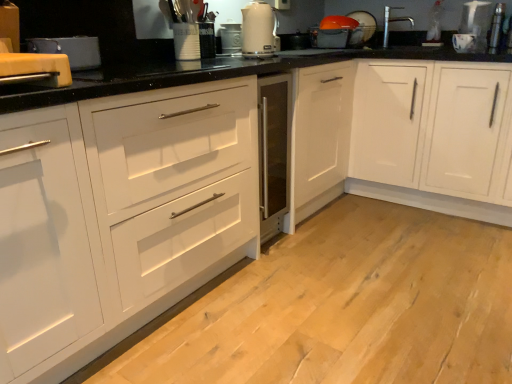
Question: Does point (247, 21) appear closer or farther from the camera than point (222, 23)?

Choices:
 (A) closer
 (B) farther

Answer: (A)

Question: Considering the positions of white glossy electric kettle at upper center and metallic silver toaster at center, which ranks as the second appliance in bottom-to-top order, in the image, is white glossy electric kettle at upper center wider or thinner than metallic silver toaster at center, which ranks as the second appliance in bottom-to-top order,?

Choices:
 (A) wide
 (B) thin

Answer: (A)

Question: Considering the real-world distances, which object is farthest from the silver metallic faucet at upper right?

Choices:
 (A) white glossy electric kettle at upper center
 (B) matte black toaster at upper left, which appears as the 1th appliance when viewed from the front
 (C) white glossy cabinet at center, which is counted as the second cabinetry, starting from the left
 (D) white matte cabinet at center, arranged as the first cabinetry when viewed from the left
 (E) metallic silver toaster at upper right, which appears as the first appliance when viewed from the right

Answer: (D)

Question: Considering the real-world distances, which object is farthest from the white matte cabinet at center, the second cabinetry from the right?

Choices:
 (A) white glossy electric kettle at upper center
 (B) matte black toaster at upper left, placed as the fourth appliance when sorted from right to left
 (C) metallic silver toaster at center, which is counted as the third appliance, starting from the back
 (D) silver metallic faucet at upper right
 (E) metallic silver toaster at upper right, which appears as the first appliance when viewed from the right

Answer: (E)